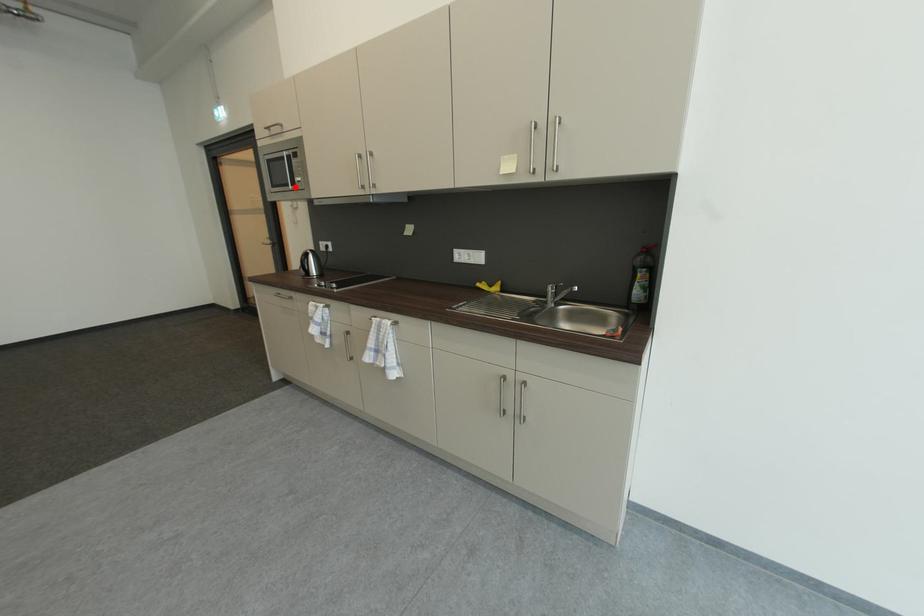
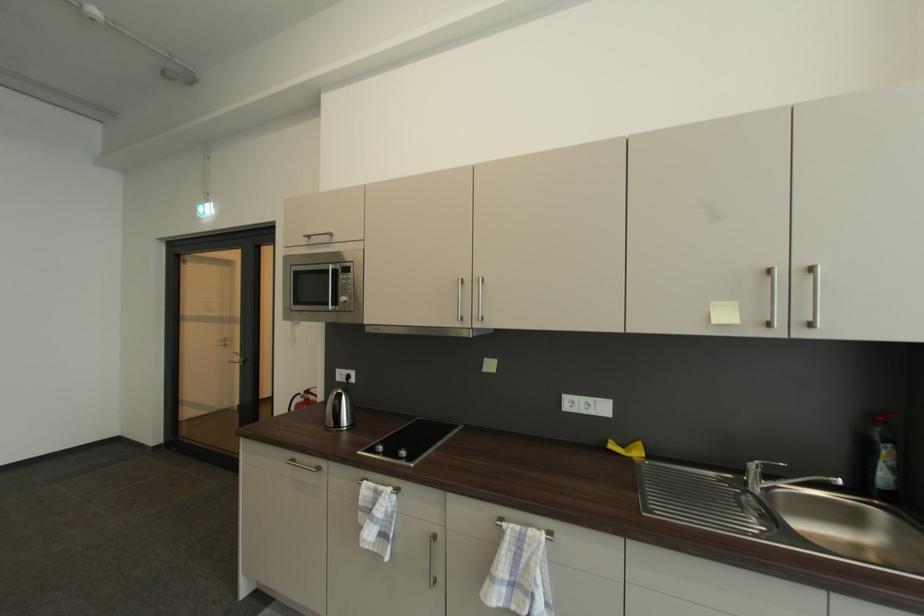
In the second image, find the point that corresponds to the highlighted location in the first image.

(334, 306)